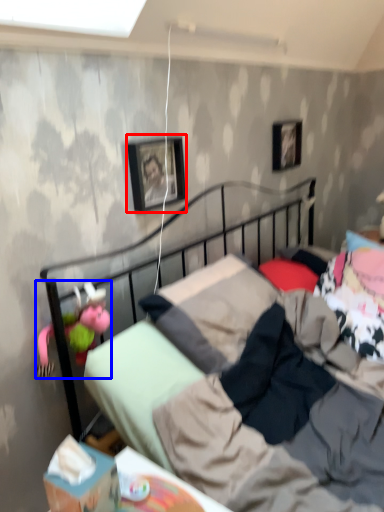
Question: Which object is further to the camera taking this photo, picture frame (highlighted by a red box) or doll (highlighted by a blue box)?

Choices:
 (A) picture frame
 (B) doll

Answer: (A)